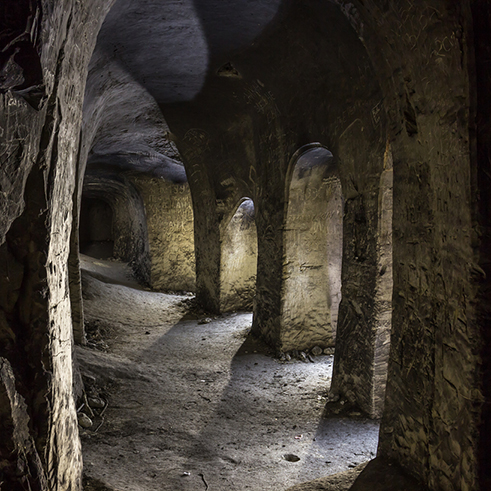
The width and height of the screenshot is (491, 491). In order to click on diagonal shadows on floor in this screenshot , I will do point(319,434), point(233,372), point(171,331), point(100,277).